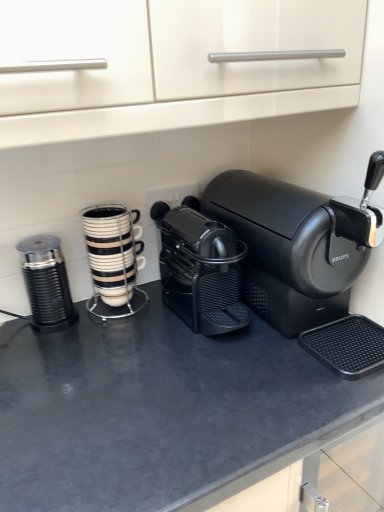
Question: From a real-world perspective, is black matte counter top at center under white glossy cup stack at center, which is the second kitchen appliance in left-to-right order?

Choices:
 (A) yes
 (B) no

Answer: (A)

Question: Considering the relative sizes of black matte counter top at center and white glossy cup stack at center, the first kitchen appliance positioned from the right, in the image provided, is black matte counter top at center taller than white glossy cup stack at center, the first kitchen appliance positioned from the right,?

Choices:
 (A) no
 (B) yes

Answer: (B)

Question: Is the surface of black matte counter top at center in direct contact with white glossy cup stack at center, the first kitchen appliance positioned from the right?

Choices:
 (A) yes
 (B) no

Answer: (B)

Question: Is black matte counter top at center aimed at white glossy cup stack at center, the first kitchen appliance positioned from the right?

Choices:
 (A) yes
 (B) no

Answer: (B)

Question: Does black matte counter top at center have a lesser height compared to white glossy cup stack at center, the first kitchen appliance positioned from the right?

Choices:
 (A) yes
 (B) no

Answer: (B)

Question: Is metallic ribbed grinder at left, which is the first kitchen appliance from left to right, spatially inside black matte coffee maker at center, which is the 1th coffee maker from right to left, or outside of it?

Choices:
 (A) inside
 (B) outside

Answer: (B)

Question: Visually, is metallic ribbed grinder at left, marked as the second kitchen appliance in a right-to-left arrangement, positioned to the left or to the right of black matte coffee maker at center, which is the 1th coffee maker from right to left?

Choices:
 (A) left
 (B) right

Answer: (A)

Question: Is metallic ribbed grinder at left, marked as the second kitchen appliance in a right-to-left arrangement, wider or thinner than black matte coffee maker at center, which is the 2th coffee maker in left-to-right order?

Choices:
 (A) thin
 (B) wide

Answer: (A)

Question: From the image's perspective, is metallic ribbed grinder at left, which is the first kitchen appliance from left to right, positioned above or below black matte coffee maker at center, which is the 1th coffee maker from right to left?

Choices:
 (A) below
 (B) above

Answer: (A)

Question: Is point (190, 252) positioned closer to the camera than point (279, 436)?

Choices:
 (A) closer
 (B) farther

Answer: (B)

Question: From the image's perspective, is black matte coffee maker at center, the second coffee maker from the right, positioned above or below black matte counter top at center?

Choices:
 (A) below
 (B) above

Answer: (B)

Question: Is black matte coffee maker at center, the first coffee maker positioned from the left, situated inside black matte counter top at center or outside?

Choices:
 (A) outside
 (B) inside

Answer: (A)

Question: Is black matte coffee maker at center, the second coffee maker from the right, wider or thinner than black matte counter top at center?

Choices:
 (A) thin
 (B) wide

Answer: (A)

Question: From the image's perspective, is metallic ribbed grinder at left, which is the first kitchen appliance from left to right, above or below black matte coffee maker at center, the first coffee maker positioned from the left?

Choices:
 (A) above
 (B) below

Answer: (B)

Question: From a real-world perspective, is metallic ribbed grinder at left, which is the first kitchen appliance from left to right, physically located above or below black matte coffee maker at center, the first coffee maker positioned from the left?

Choices:
 (A) above
 (B) below

Answer: (B)